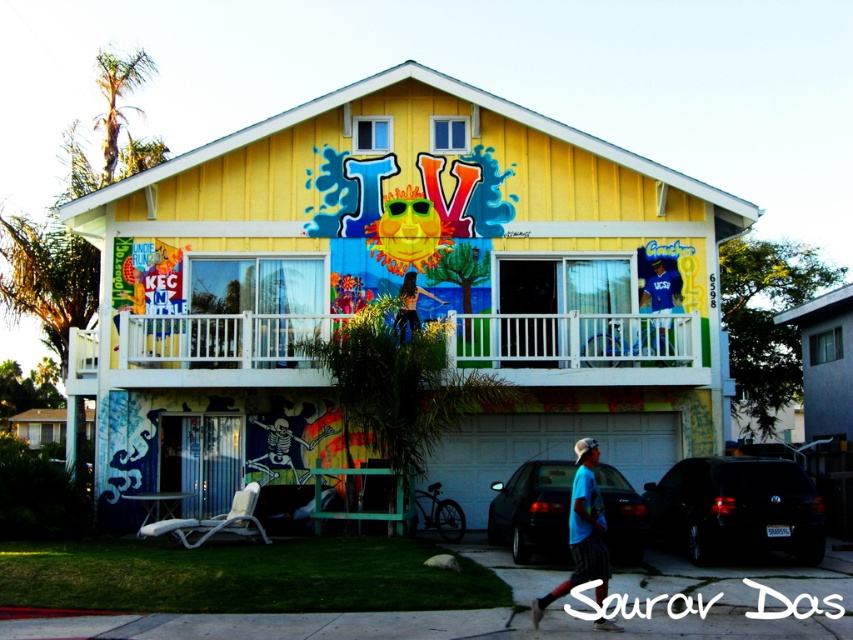
Between white plastic railing at upper center and blue t-shirt at lower right, which one is positioned higher?

Positioned higher is white plastic railing at upper center.

Does white plastic railing at upper center appear over blue t-shirt at lower right?

Correct, white plastic railing at upper center is located above blue t-shirt at lower right.

Is point (238, 330) closer to viewer compared to point (535, 621)?

No.

Where is `white plastic railing at upper center`? The image size is (853, 640). white plastic railing at upper center is located at coordinates (579, 348).

Is black matte suv at lower right positioned in front of blue t-shirt at lower right?

No.

Is point (706, 490) less distant than point (552, 593)?

That is False.

The height and width of the screenshot is (640, 853). What do you see at coordinates (735, 508) in the screenshot?
I see `black matte suv at lower right` at bounding box center [735, 508].

The image size is (853, 640). I want to click on black matte suv at lower right, so click(x=735, y=508).

Is white plastic railing at upper center smaller than matte black pants at center?

Incorrect, white plastic railing at upper center is not smaller in size than matte black pants at center.

Is white plastic railing at upper center in front of matte black pants at center?

No, white plastic railing at upper center is further to the viewer.

The height and width of the screenshot is (640, 853). What do you see at coordinates (579, 348) in the screenshot? I see `white plastic railing at upper center` at bounding box center [579, 348].

Locate an element on the screen. The image size is (853, 640). white plastic railing at upper center is located at coordinates (579, 348).